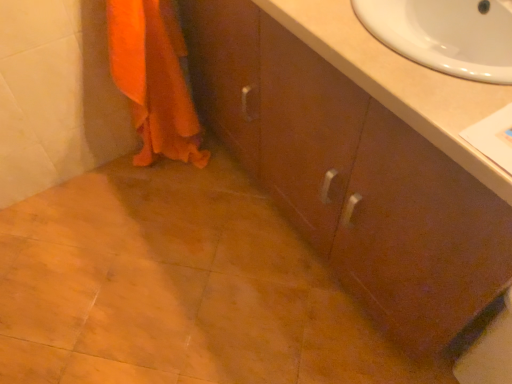
Question: In terms of height, does orange fabric towel at lower left look taller or shorter compared to beige laminate sink at upper right?

Choices:
 (A) short
 (B) tall

Answer: (B)

Question: From the image's perspective, is orange fabric towel at lower left above or below beige laminate sink at upper right?

Choices:
 (A) above
 (B) below

Answer: (A)

Question: Which object is positioned farthest from the beige laminate sink at upper right?

Choices:
 (A) matte brown cabinet at center
 (B) orange fabric towel at lower left

Answer: (B)

Question: Which object is the farthest from the matte brown cabinet at center?

Choices:
 (A) beige laminate sink at upper right
 (B) orange fabric towel at lower left

Answer: (B)